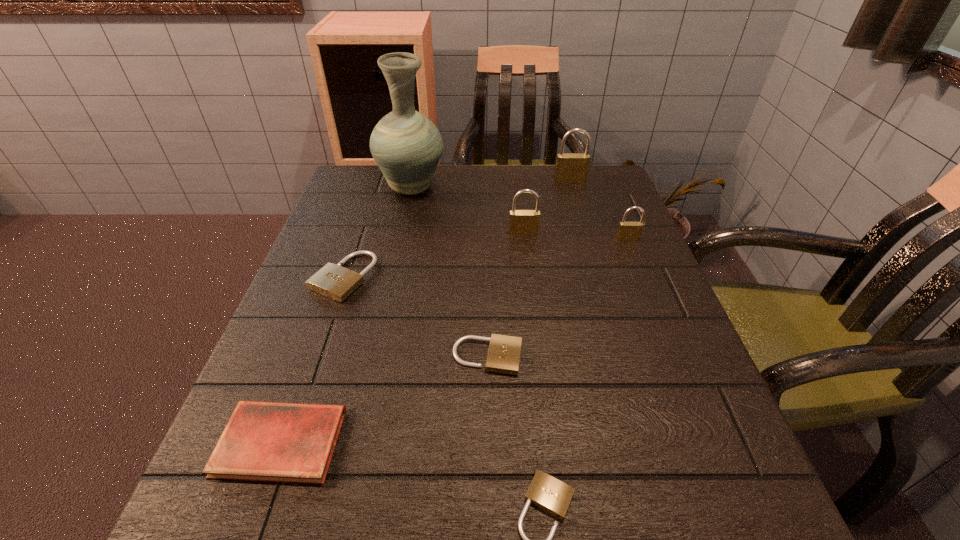
You are a GUI agent. You are given a task and a screenshot of the screen. Output one action in this format:
    pyautogui.click(x=<x>, y=<y>)
    Task: Click on the vacant space at the near left corner
    This screenshot has width=960, height=540.
    Given the screenshot: What is the action you would take?
    click(x=235, y=528)

Identify the location of vacant space at the far right corner of the desktop. This screenshot has width=960, height=540. (578, 204).

Where is `unoccupied area between the fifth shortest padlock and the tallest object`? The width and height of the screenshot is (960, 540). unoccupied area between the fifth shortest padlock and the tallest object is located at coordinates (468, 211).

At what (x,y) coordinates should I click in order to perform the action: click on free spot between the second tallest padlock and the red diary. Please return your answer as a coordinate pair (x, y). Looking at the image, I should click on (402, 338).

You are a GUI agent. You are given a task and a screenshot of the screen. Output one action in this format:
    pyautogui.click(x=<x>, y=<y>)
    Task: Click on the free point between the biggest brass padlock and the second farthest beige padlock
    The image size is (960, 540).
    Given the screenshot: What is the action you would take?
    pyautogui.click(x=529, y=268)

This screenshot has height=540, width=960. Identify the location of unoccupied area between the smallest brass padlock and the second nearest padlock. (558, 298).

The height and width of the screenshot is (540, 960). I want to click on vacant space in between the fifth padlock from left to right and the second smallest brass padlock, so click(x=547, y=206).

Locate an element on the screen. The width and height of the screenshot is (960, 540). empty space between the second smallest beige padlock and the leftmost brass padlock is located at coordinates (506, 295).

You are a GUI agent. You are given a task and a screenshot of the screen. Output one action in this format:
    pyautogui.click(x=<x>, y=<y>)
    Task: Click on the vacant region between the second biggest brass padlock and the red diary
    Image resolution: width=960 pixels, height=540 pixels.
    Given the screenshot: What is the action you would take?
    pyautogui.click(x=402, y=338)

Identify the location of free space between the third farthest object and the fifth tallest padlock. (506, 295).